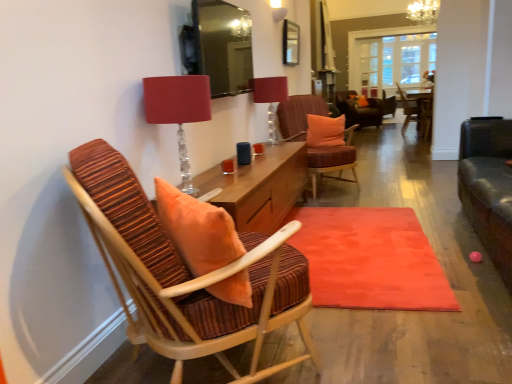
Question: Looking at their shapes, would you say matte orange rug at center is wider or thinner than wooden chair with striped upholstery at center, the third chair positioned from the back?

Choices:
 (A) thin
 (B) wide

Answer: (B)

Question: Which is correct: matte orange rug at center is inside wooden chair with striped upholstery at center, the third chair positioned from the back, or outside of it?

Choices:
 (A) inside
 (B) outside

Answer: (B)

Question: Which object is positioned farthest from the striped fabric chair at left, the first chair from the front?

Choices:
 (A) orange fabric pillow at center, the 1th pillow positioned from the top
 (B) orange fabric pillow at center, positioned as the first pillow in front-to-back order
 (C) wooden chair with striped upholstery at center, the 5th chair viewed from the left
 (D) matte red lampshade at upper center, the first table lamp ordered from the bottom
 (E) matte glass table lamp at upper center, the 1th table lamp positioned from the right

Answer: (A)

Question: Which object is positioned closest to the striped fabric chair at center, which is counted as the 2th chair, starting from the front?

Choices:
 (A) clear glass door at center
 (B) wooden chair with striped cushion at center, acting as the 2th chair starting from the right
 (C) velvet orange chair at center, positioned as the fifth chair in front-to-back order
 (D) orange fabric pillow at center, arranged as the second pillow when viewed from the right
 (E) matte orange rug at center

Answer: (D)